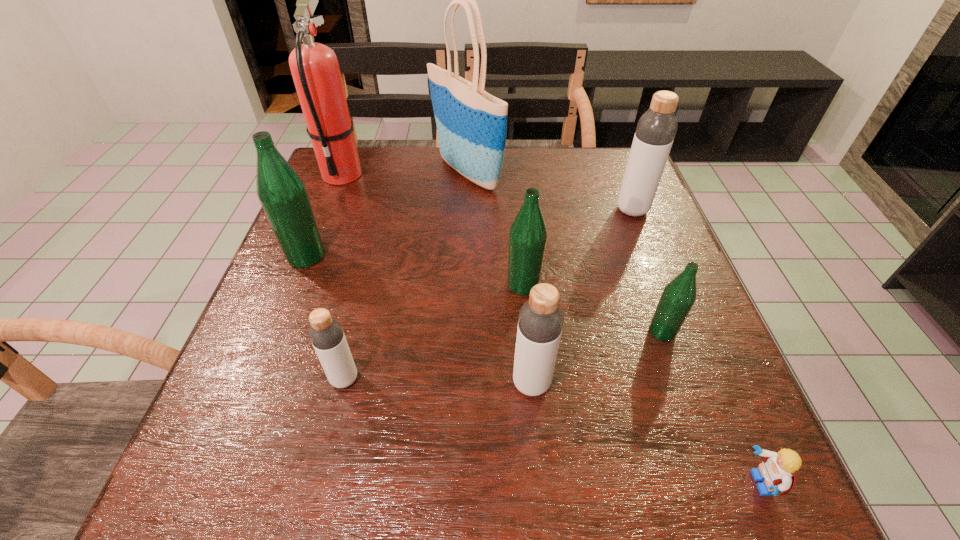
Image resolution: width=960 pixels, height=540 pixels. Identify the location of vacant space situated 0.060m on the front of the second gray bottle from left to right. (536, 434).

This screenshot has width=960, height=540. Identify the location of free space located on the back of the second bottle from left to right. (372, 266).

Identify the location of free space located on the front of the rightmost green bottle. (717, 486).

At what (x,y) coordinates should I click in order to perform the action: click on vacant space located 0.380m on the front-facing side of the shortest object. Please return your answer as a coordinate pair (x, y). The width and height of the screenshot is (960, 540). Looking at the image, I should click on (489, 483).

Find the location of a particular element. The width and height of the screenshot is (960, 540). vacant area situated 0.230m on the front-facing side of the shortest object is located at coordinates coord(588,483).

Where is `vacant space located on the front-facing side of the shortest object`? The width and height of the screenshot is (960, 540). vacant space located on the front-facing side of the shortest object is located at coordinates (642, 483).

At what (x,y) coordinates should I click in order to perform the action: click on tote bag that is at the far edge. Please return your answer as a coordinate pair (x, y). Looking at the image, I should click on (471, 124).

Identify the location of fire extinguisher located in the far edge section of the desktop. (314, 66).

Locate an element on the screen. object present at the near edge is located at coordinates (778, 470).

Find the location of a particular element. The image size is (960, 540). fire extinguisher located in the left edge section of the desktop is located at coordinates (314, 66).